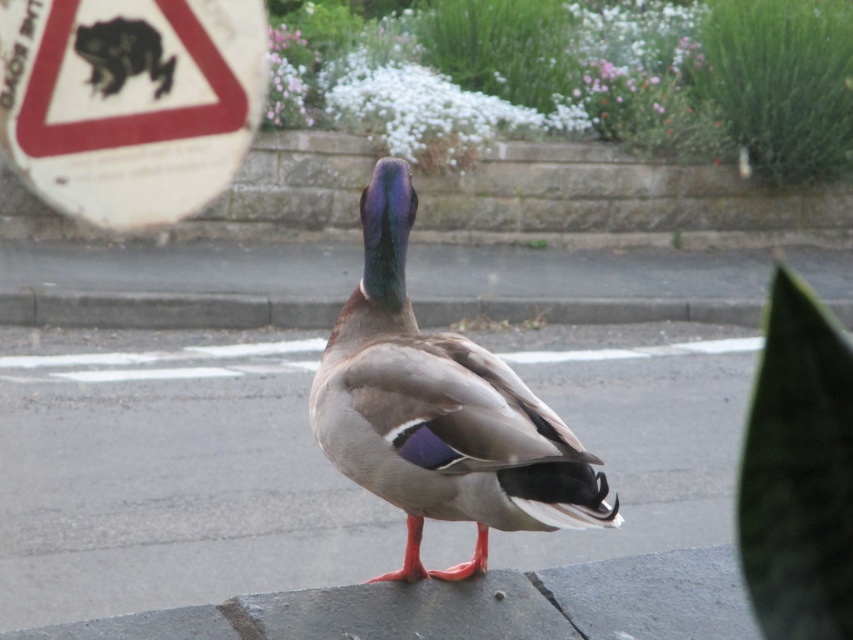
Question: Can you confirm if brown feathered duck at center is positioned to the right of white paper sign at upper left?

Choices:
 (A) yes
 (B) no

Answer: (A)

Question: Which object appears farthest from the camera in this image?

Choices:
 (A) white paper sign at upper left
 (B) gray concrete pavement at center

Answer: (A)

Question: Which object is closer to the camera taking this photo?

Choices:
 (A) gray concrete pavement at center
 (B) white paper sign at upper left
 (C) brown feathered duck at center

Answer: (C)

Question: Is brown feathered duck at center closer to camera compared to white paper sign at upper left?

Choices:
 (A) yes
 (B) no

Answer: (A)

Question: Does brown feathered duck at center have a greater width compared to white paper sign at upper left?

Choices:
 (A) yes
 (B) no

Answer: (B)

Question: Estimate the real-world distances between objects in this image. Which object is closer to the brown feathered duck at center?

Choices:
 (A) gray concrete pavement at center
 (B) white paper sign at upper left
 (C) gray concrete curb at lower center

Answer: (A)